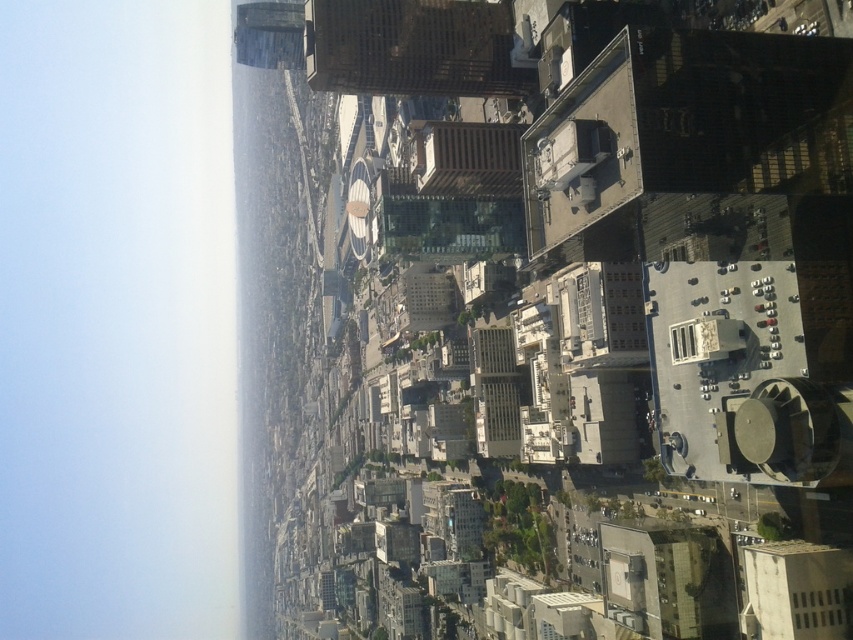
You are looking at an aerial view of a city from a high vantage point. You notice two transparent glass windows in the image. One is labeled as the transparent glass window at lower right and the other as the transparent glass window at upper right. Which of these windows is closer to your viewpoint?

The transparent glass window at lower right is closer to your viewpoint because it is in front of the transparent glass window at upper right.

You are a window installer assessing the building from above. You need to determine which of the two transparent glass windows, the transparent glass window at lower right or the transparent glass window at upper right, requires a taller frame. Which one do you choose?

The transparent glass window at upper right requires a taller frame because it has a greater height than the transparent glass window at lower right.